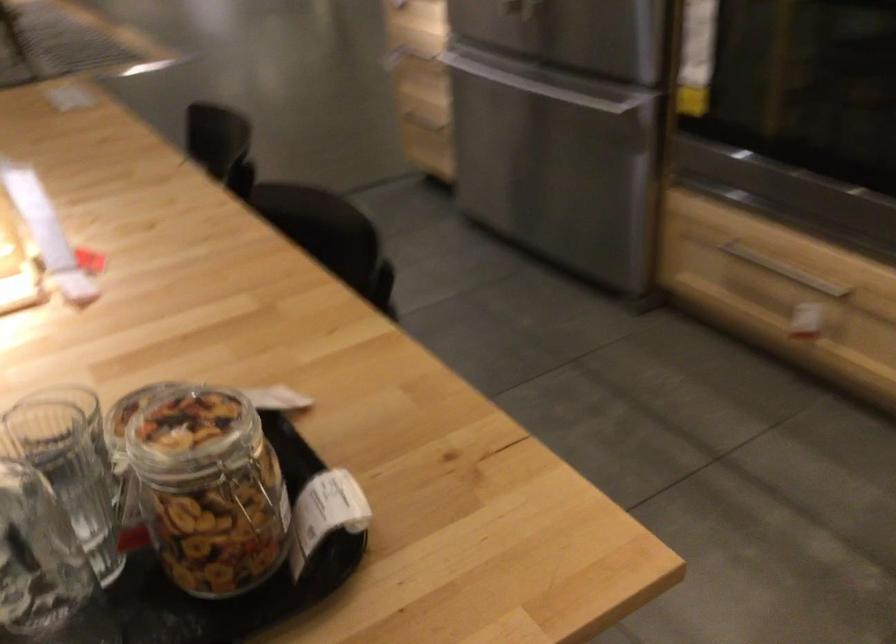
The width and height of the screenshot is (896, 644). Find the location of `cabinet drawer handle`. cabinet drawer handle is located at coordinates (784, 270).